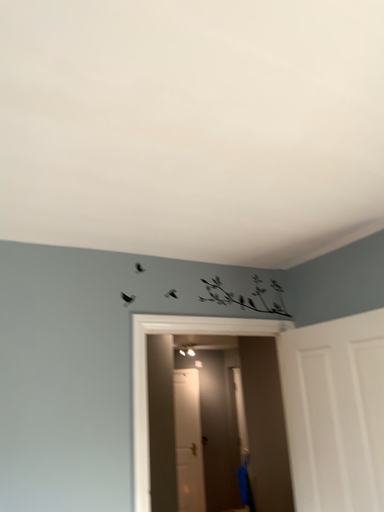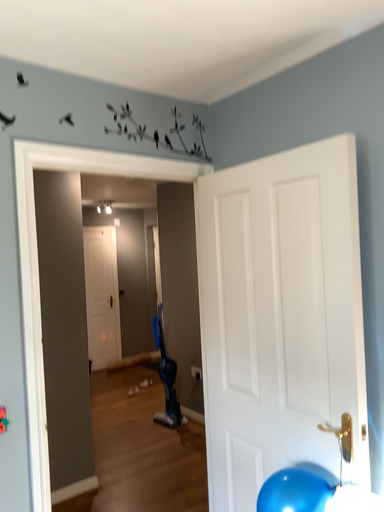
Question: Which way did the camera rotate in the video?

Choices:
 (A) rotated downward
 (B) rotated upward

Answer: (A)